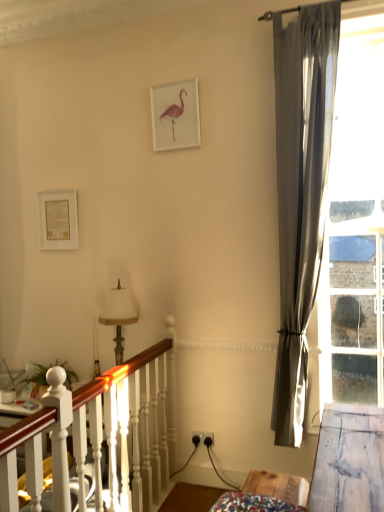
The height and width of the screenshot is (512, 384). What do you see at coordinates (57, 220) in the screenshot?
I see `matte gold picture frame at upper left, acting as the first picture frame starting from the left` at bounding box center [57, 220].

What is the approximate height of white fabric lampshade at center-left?

The height of white fabric lampshade at center-left is 23.80 inches.

You are a GUI agent. You are given a task and a screenshot of the screen. Output one action in this format:
    pyautogui.click(x=<x>, y=<y>)
    Task: Click on the white matte picture frame at upper center, the 2th picture frame in the left-to-right sequence
    The width and height of the screenshot is (384, 512).
    Given the screenshot: What is the action you would take?
    pyautogui.click(x=175, y=115)

Considering the positions of objects matte gold picture frame at upper left, acting as the first picture frame starting from the left, and wooden table at lower right in the image provided, who is more to the right, matte gold picture frame at upper left, acting as the first picture frame starting from the left, or wooden table at lower right?

Positioned to the right is wooden table at lower right.

From the image's perspective, is matte gold picture frame at upper left, which is the second picture frame in right-to-left order, located above or below wooden table at lower right?

matte gold picture frame at upper left, which is the second picture frame in right-to-left order, is above wooden table at lower right.

Who is more distant, matte gold picture frame at upper left, acting as the 1th picture frame starting from the back, or wooden table at lower right?

matte gold picture frame at upper left, acting as the 1th picture frame starting from the back.

Does point (183, 90) come in front of point (323, 216)?

That is False.

From a real-world perspective, which object rests below the other?

In real-world perspective, satin gray curtain at right is lower.

From the picture: From the image's perspective, is white matte picture frame at upper center, the 2th picture frame in the left-to-right sequence, located beneath satin gray curtain at right?

No.

Looking at this image, which is more to the left, white matte picture frame at upper center, placed as the first picture frame when sorted from front to back, or satin gray curtain at right?

From the viewer's perspective, white matte picture frame at upper center, placed as the first picture frame when sorted from front to back, appears more on the left side.

From the image's perspective, which object appears higher, white matte picture frame at upper center, which is counted as the first picture frame, starting from the right, or white wooden bed frame at lower left?

white matte picture frame at upper center, which is counted as the first picture frame, starting from the right.

Would you consider white matte picture frame at upper center, positioned as the first picture frame in top-to-bottom order, to be distant from white wooden bed frame at lower left?

Yes, white matte picture frame at upper center, positioned as the first picture frame in top-to-bottom order, and white wooden bed frame at lower left are quite far apart.

What's the angular difference between white matte picture frame at upper center, the 2th picture frame in the left-to-right sequence, and white wooden bed frame at lower left's facing directions?

white matte picture frame at upper center, the 2th picture frame in the left-to-right sequence, and white wooden bed frame at lower left are facing 89.1 degrees away from each other.

Which object is more forward, white matte picture frame at upper center, positioned as the first picture frame in top-to-bottom order, or white wooden bed frame at lower left?

white wooden bed frame at lower left.

Based on their sizes in the image, would you say clear glass window at right is bigger or smaller than white matte picture frame at upper center, the 2th picture frame when ordered from bottom to top?

Clearly, clear glass window at right is larger in size than white matte picture frame at upper center, the 2th picture frame when ordered from bottom to top.

Looking at this image, who is taller, clear glass window at right or white matte picture frame at upper center, positioned as the first picture frame in top-to-bottom order?

clear glass window at right.

How different are the orientations of clear glass window at right and white matte picture frame at upper center, the 2th picture frame when ordered from bottom to top, in degrees?

8.86e-05 degrees separate the facing orientations of clear glass window at right and white matte picture frame at upper center, the 2th picture frame when ordered from bottom to top.

Is clear glass window at right positioned with its back to white matte picture frame at upper center, the 2th picture frame in the left-to-right sequence?

No, clear glass window at right is not facing away from white matte picture frame at upper center, the 2th picture frame in the left-to-right sequence.

In the scene shown: Which object is wider, wooden table at lower right or white matte picture frame at upper center, positioned as the first picture frame in top-to-bottom order?

Wider between the two is wooden table at lower right.

Is wooden table at lower right facing away from white matte picture frame at upper center, which is counted as the first picture frame, starting from the right?

No, white matte picture frame at upper center, which is counted as the first picture frame, starting from the right, is not at the back of wooden table at lower right.

Considering the relative sizes of wooden table at lower right and white matte picture frame at upper center, placed as the first picture frame when sorted from front to back, in the image provided, is wooden table at lower right taller than white matte picture frame at upper center, placed as the first picture frame when sorted from front to back,?

No, wooden table at lower right is not taller than white matte picture frame at upper center, placed as the first picture frame when sorted from front to back.

Would you say wooden table at lower right is outside white matte picture frame at upper center, the 2th picture frame in the left-to-right sequence?

Yes.

Is white wooden bed frame at lower left positioned beyond the bounds of satin gray curtain at right?

Absolutely, white wooden bed frame at lower left is external to satin gray curtain at right.

The image size is (384, 512). What are the coordinates of `curtain that is above the white wooden bed frame at lower left (from the image's perspective)` in the screenshot? It's located at (301, 193).

Is white wooden bed frame at lower left wider than satin gray curtain at right?

In fact, white wooden bed frame at lower left might be narrower than satin gray curtain at right.

Which is more to the right, white wooden bed frame at lower left or satin gray curtain at right?

Positioned to the right is satin gray curtain at right.

How many degrees apart are the facing directions of wooden table at lower right and clear glass window at right?

94.6 degrees separate the facing orientations of wooden table at lower right and clear glass window at right.

Which of these two, wooden table at lower right or clear glass window at right, is wider?

With larger width is wooden table at lower right.

Can we say wooden table at lower right lies outside clear glass window at right?

Absolutely, wooden table at lower right is external to clear glass window at right.

From a real-world perspective, does wooden table at lower right sit lower than clear glass window at right?

Yes.

At what (x,y) coordinates should I click in order to perform the action: click on furniture in front of the matte gold picture frame at upper left, which is the second picture frame in right-to-left order. Please return your answer as a coordinate pair (x, y). The image size is (384, 512). Looking at the image, I should click on (278, 486).

The height and width of the screenshot is (512, 384). Identify the location of the 1st picture frame to the left of the satin gray curtain at right, starting your count from the anchor. (175, 115).

Considering their positions, is wooden table at lower right positioned closer to white matte picture frame at upper center, acting as the second picture frame starting from the back, than satin gray curtain at right?

satin gray curtain at right.

Looking at the image, which one is located closer to white wooden bed frame at lower left, wooden table at lower right or white fabric lampshade at center-left?

white fabric lampshade at center-left lies closer to white wooden bed frame at lower left than the other object.

Looking at the image, which one is located closer to white fabric lampshade at center-left, clear glass window at right or wooden table at lower right?

wooden table at lower right.

Based on their spatial positions, is matte gold picture frame at upper left, placed as the 1th picture frame when sorted from bottom to top, or white matte picture frame at upper center, which is counted as the first picture frame, starting from the right, further from wooden table at lower right?

white matte picture frame at upper center, which is counted as the first picture frame, starting from the right, lies further to wooden table at lower right than the other object.

When comparing their distances from white fabric lampshade at center-left, does matte gold picture frame at upper left, which is the second picture frame in right-to-left order, or white matte picture frame at upper center, the 2th picture frame when ordered from bottom to top, seem further?

Among the two, white matte picture frame at upper center, the 2th picture frame when ordered from bottom to top, is located further to white fabric lampshade at center-left.

From the image, which object appears to be farther from white wooden bed frame at lower left, wooden table at lower right or white matte picture frame at upper center, positioned as the first picture frame in top-to-bottom order?

white matte picture frame at upper center, positioned as the first picture frame in top-to-bottom order.

Based on their spatial positions, is white fabric lampshade at center-left or matte gold picture frame at upper left, acting as the 1th picture frame starting from the back, further from white wooden bed frame at lower left?

matte gold picture frame at upper left, acting as the 1th picture frame starting from the back, is positioned further to the anchor white wooden bed frame at lower left.

Estimate the real-world distances between objects in this image. Which object is closer to satin gray curtain at right, matte gold picture frame at upper left, placed as the 1th picture frame when sorted from bottom to top, or white wooden bed frame at lower left?

The object closer to satin gray curtain at right is white wooden bed frame at lower left.

Where is `bed frame between matte gold picture frame at upper left, the 2th picture frame in the top-to-bottom sequence, and clear glass window at right from left to right`? The height and width of the screenshot is (512, 384). bed frame between matte gold picture frame at upper left, the 2th picture frame in the top-to-bottom sequence, and clear glass window at right from left to right is located at coordinates (96, 437).

You are a GUI agent. You are given a task and a screenshot of the screen. Output one action in this format:
    pyautogui.click(x=<x>, y=<y>)
    Task: Click on the bay window between white matte picture frame at upper center, placed as the first picture frame when sorted from front to back, and wooden table at lower right, in the vertical direction
    
    Given the screenshot: What is the action you would take?
    pyautogui.click(x=353, y=232)

I want to click on table lamp situated between matte gold picture frame at upper left, the 2th picture frame in the top-to-bottom sequence, and clear glass window at right from left to right, so click(118, 316).

The height and width of the screenshot is (512, 384). In order to click on furniture between matte gold picture frame at upper left, acting as the 1th picture frame starting from the back, and satin gray curtain at right from left to right in this screenshot , I will do `click(278, 486)`.